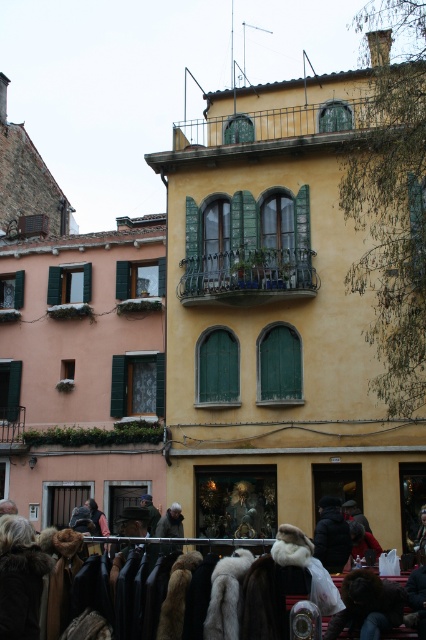
Question: Which point is farther from the camera taking this photo?

Choices:
 (A) (245, 561)
 (B) (157, 577)

Answer: (B)

Question: Can you confirm if fur coats at lower center is bigger than white fur coat at center?

Choices:
 (A) no
 (B) yes

Answer: (B)

Question: Does fur coats at lower center have a greater width compared to brown furry coat at lower center?

Choices:
 (A) no
 (B) yes

Answer: (B)

Question: Can you confirm if fur coats at lower center is bigger than white fur coat at center?

Choices:
 (A) no
 (B) yes

Answer: (B)

Question: Which object appears closest to the camera in this image?

Choices:
 (A) brown furry coat at lower center
 (B) white fur coat at center
 (C) fur coats at lower center

Answer: (C)

Question: Considering the real-world distances, which object is farthest from the brown furry coat at lower center?

Choices:
 (A) white fur coat at center
 (B) fur coats at lower center

Answer: (B)